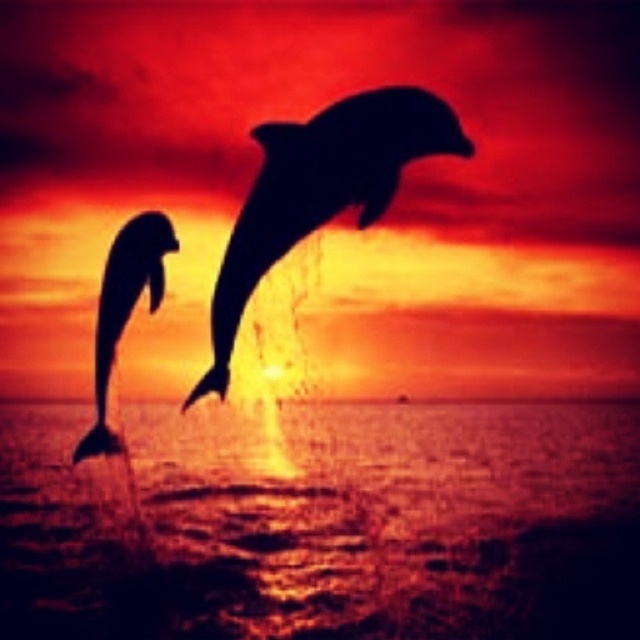
You are an astronomer analyzing the sunset scene. You have a point marked at coordinates (321, 189). Based on the scene description, which object in the image does this point belong to?

The point at coordinates (321, 189) is on the black silhouette dolphin at center.

You are a photographer trying to capture the sunset with both the transparent water at lower center and the black silhouette dolphin at center in your shot. Which object will occupy more of the frame in your photo?

The transparent water at lower center will occupy more of the frame because it is bigger than the black silhouette dolphin at center according to the description.